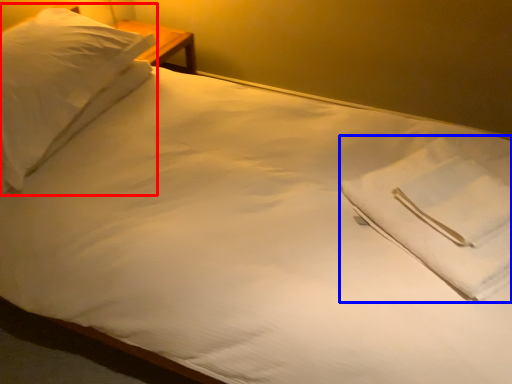
Question: Which object appears closest to the camera in this image, pillow (highlighted by a red box) or cloth (highlighted by a blue box)?

Choices:
 (A) pillow
 (B) cloth

Answer: (B)